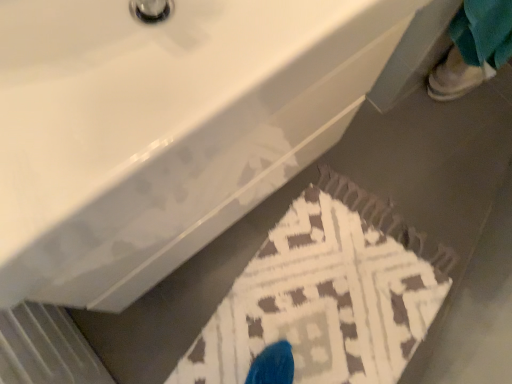
I want to click on white glossy sink at upper center, so click(163, 128).

At what (x,y) coordinates should I click in order to perform the action: click on white leather shoe at upper right. Please return your answer as a coordinate pair (x, y). Image resolution: width=512 pixels, height=384 pixels. Looking at the image, I should click on (473, 48).

Based on the photo, measure the distance between brown textured rug at lower center and camera.

brown textured rug at lower center and camera are 3.80 feet apart from each other.

The image size is (512, 384). What are the coordinates of `white glossy sink at upper center` in the screenshot? It's located at (163, 128).

From a real-world perspective, is white glossy sink at upper center below brown textured rug at lower center?

A: Incorrect, from a real-world perspective, white glossy sink at upper center is higher than brown textured rug at lower center.

Does white glossy sink at upper center lie behind brown textured rug at lower center?

No.

Where is `sink located in front of the brown textured rug at lower center`? The width and height of the screenshot is (512, 384). sink located in front of the brown textured rug at lower center is located at coordinates (163, 128).

Can we say white glossy sink at upper center lies outside brown textured rug at lower center?

Indeed, white glossy sink at upper center is completely outside brown textured rug at lower center.

Is white leather shoe at upper right inside brown textured rug at lower center?

No.

Is brown textured rug at lower center taller than white leather shoe at upper right?

No.

Which of these two, brown textured rug at lower center or white leather shoe at upper right, is smaller?

white leather shoe at upper right.

Locate an element on the screen. doormat to the left of white leather shoe at upper right is located at coordinates (328, 293).

Would you consider white glossy sink at upper center to be distant from white leather shoe at upper right?

That's not correct — white glossy sink at upper center is a little close to white leather shoe at upper right.

Which of these two, white glossy sink at upper center or white leather shoe at upper right, is bigger?

white glossy sink at upper center is bigger.

Is white glossy sink at upper center wider than white leather shoe at upper right?

Yes.

The height and width of the screenshot is (384, 512). I want to click on sink located on the left of white leather shoe at upper right, so click(163, 128).

Is brown textured rug at lower center turned away from white glossy sink at upper center?

No, brown textured rug at lower center's orientation is not away from white glossy sink at upper center.

Which object is wider, brown textured rug at lower center or white glossy sink at upper center?

Wider between the two is brown textured rug at lower center.

From a real-world perspective, between brown textured rug at lower center and white glossy sink at upper center, who is vertically lower?

From a 3D spatial view, brown textured rug at lower center is below.

Consider the image. Is white leather shoe at upper right turned away from white glossy sink at upper center?

No.

Between white leather shoe at upper right and white glossy sink at upper center, which one has smaller width?

Thinner between the two is white leather shoe at upper right.

Do you think white leather shoe at upper right is within white glossy sink at upper center, or outside of it?

white leather shoe at upper right is not inside white glossy sink at upper center, it's outside.

From a real-world perspective, is white leather shoe at upper right positioned above or below brown textured rug at lower center?

Clearly, from a real-world perspective, white leather shoe at upper right is above brown textured rug at lower center.

Is brown textured rug at lower center inside white leather shoe at upper right?

That's incorrect, brown textured rug at lower center is not inside white leather shoe at upper right.

From the picture: Is white leather shoe at upper right wider than brown textured rug at lower center?

No, white leather shoe at upper right is not wider than brown textured rug at lower center.

Is white leather shoe at upper right in contact with brown textured rug at lower center?

No, white leather shoe at upper right is not touching brown textured rug at lower center.

I want to click on doormat behind the white glossy sink at upper center, so click(x=328, y=293).

The image size is (512, 384). What are the coordinates of `doormat beneath the white leather shoe at upper right (from a real-world perspective)` in the screenshot? It's located at (328, 293).

Which object lies nearer to the anchor point brown textured rug at lower center, white leather shoe at upper right or white glossy sink at upper center?

white glossy sink at upper center is positioned closer to the anchor brown textured rug at lower center.

From the image, which object appears to be nearer to white leather shoe at upper right, brown textured rug at lower center or white glossy sink at upper center?

brown textured rug at lower center.

When comparing their distances from brown textured rug at lower center, does white glossy sink at upper center or white leather shoe at upper right seem further?

white leather shoe at upper right is positioned further to the anchor brown textured rug at lower center.

Considering their positions, is white glossy sink at upper center positioned closer to white leather shoe at upper right than brown textured rug at lower center?

Based on the image, brown textured rug at lower center appears to be nearer to white leather shoe at upper right.

Which object lies further to the anchor point white glossy sink at upper center, white leather shoe at upper right or brown textured rug at lower center?

white leather shoe at upper right is positioned further to the anchor white glossy sink at upper center.

From the image, which object appears to be nearer to white glossy sink at upper center, brown textured rug at lower center or white leather shoe at upper right?

Based on the image, brown textured rug at lower center appears to be nearer to white glossy sink at upper center.

Where is `doormat between white glossy sink at upper center and white leather shoe at upper right in the front-back direction`? The image size is (512, 384). doormat between white glossy sink at upper center and white leather shoe at upper right in the front-back direction is located at coordinates (328, 293).